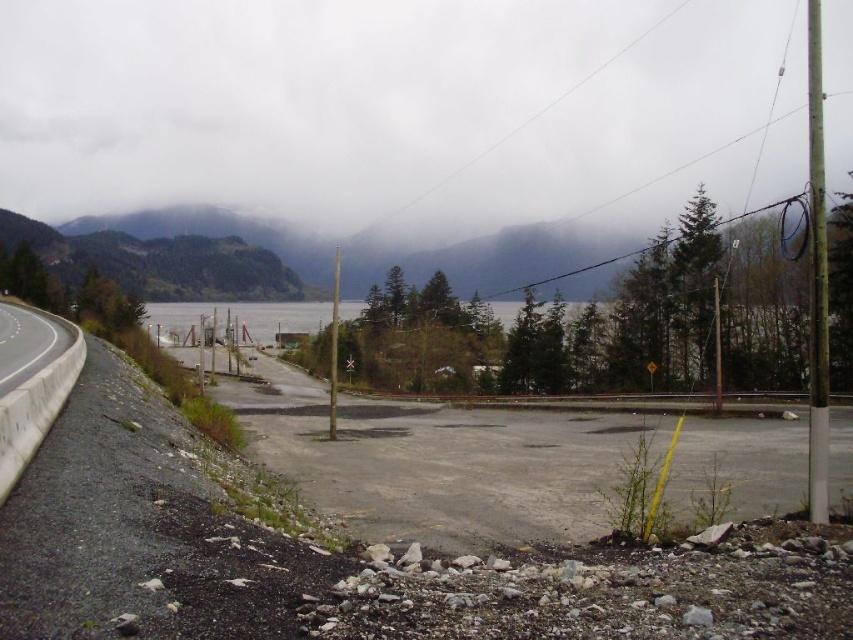
Which is in front, point (666, 20) or point (64, 323)?

Positioned in front is point (64, 323).

You are a GUI agent. You are given a task and a screenshot of the screen. Output one action in this format:
    pyautogui.click(x=<x>, y=<y>)
    Task: Click on the cloudy fog at upper center
    
    Given the screenshot: What is the action you would take?
    pyautogui.click(x=384, y=108)

The height and width of the screenshot is (640, 853). Identify the location of cloudy fog at upper center. (384, 108).